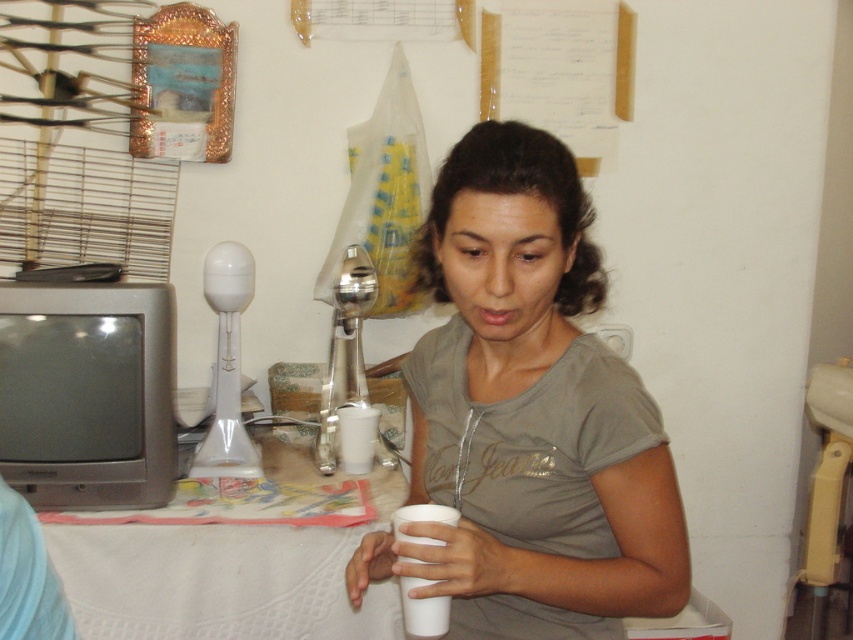
Is white cloth table at lower left shorter than white paper cup at lower center?

No, white cloth table at lower left is not shorter than white paper cup at lower center.

Based on the photo, who is more distant from viewer, (273,540) or (421,632)?

Point (273,540)

Where is `white cloth table at lower left`? This screenshot has width=853, height=640. white cloth table at lower left is located at coordinates (224, 577).

Measure the distance from matte gray shirt at center to white cloth table at lower left.

matte gray shirt at center and white cloth table at lower left are 22.28 inches apart.

Which is below, matte gray shirt at center or white cloth table at lower left?

white cloth table at lower left is lower down.

Locate an element on the screen. matte gray shirt at center is located at coordinates (529, 413).

Between matte gray shirt at center and white paper cup at lower center, which one is positioned lower?

white paper cup at lower center

Can you confirm if matte gray shirt at center is thinner than white paper cup at lower center?

No.

Identify the location of matte gray shirt at center. Image resolution: width=853 pixels, height=640 pixels. (529, 413).

What are the coordinates of `matte gray shirt at center` in the screenshot? It's located at (529, 413).